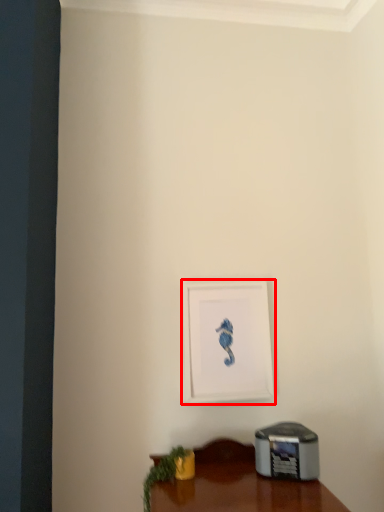
Question: From the image's perspective, what is the correct spatial relationship of picture frame (annotated by the red box) in relation to plant?

Choices:
 (A) below
 (B) above

Answer: (B)